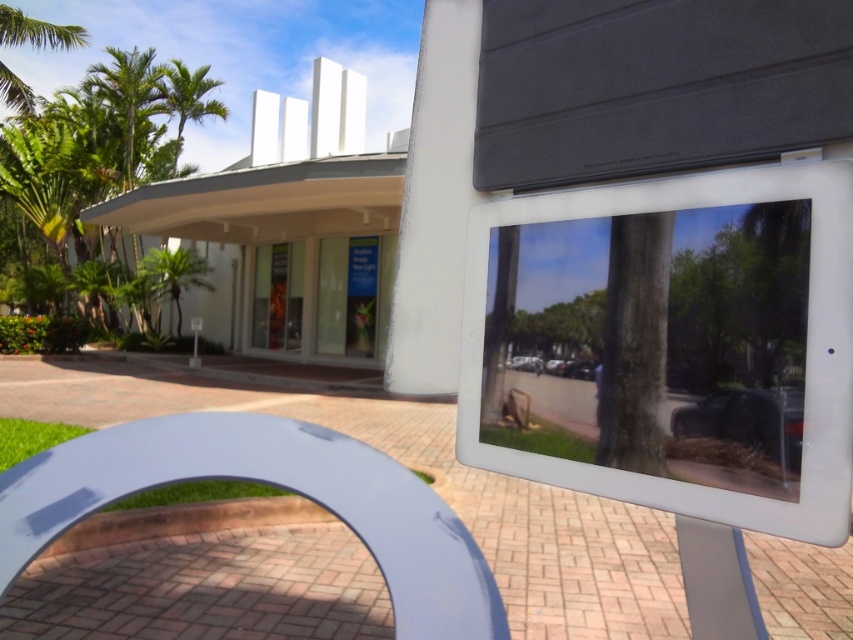
You are standing at the center of the paved area in front of the modern building. Which direction should you walk to reach the green leafy palm tree at upper left?

The green leafy palm tree at upper left is located at point (190, 97), which is towards the upper left direction from your current position at the center of the paved area. Therefore, you should walk towards the upper left to reach it.

Looking at this image, you are standing in front of the modern building and want to take a photo that includes both the green leafy palm tree at upper left and the green leafy palm tree at center. Which palm tree should you frame closer to the edge of the photo to ensure both are visible?

You should frame the green leafy palm tree at center closer to the edge of the photo because it is smaller than the green leafy palm tree at upper left, allowing both to fit within the frame.

You are standing at the front of the modern building and want to place two markers at point (187, 99) and point (202, 269). Which marker will be closer to the entrance of the building?

Point (202, 269) is closer to the entrance of the building because it is in front of point (187, 99), which is behind it.